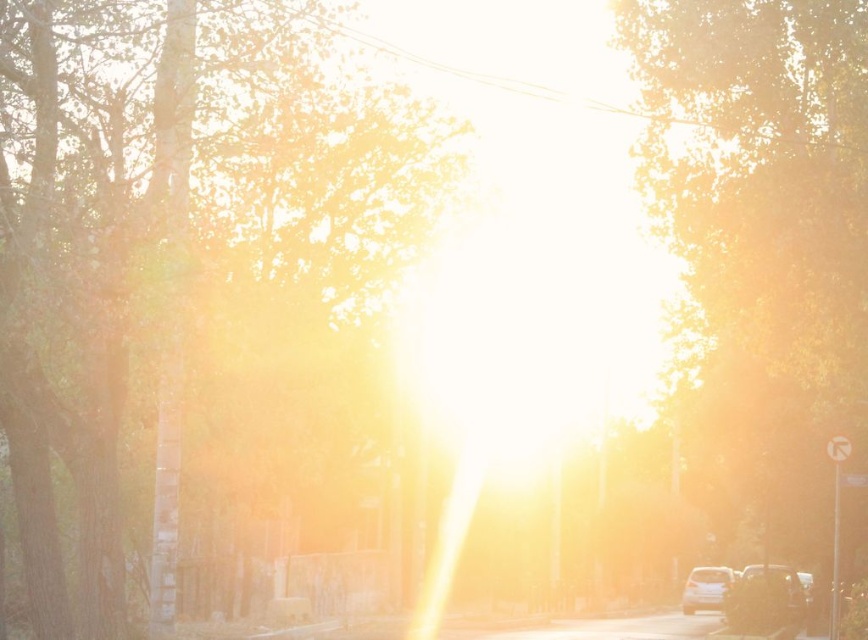
Question: Does smooth golden tree at right come behind satin white car at lower right?

Choices:
 (A) yes
 (B) no

Answer: (B)

Question: Which object appears farthest from the camera in this image?

Choices:
 (A) smokey black car at lower right
 (B) white plastic street sign at center
 (C) smooth brown tree trunk at center
 (D) satin white car at lower right

Answer: (D)

Question: Can you confirm if smooth brown tree trunk at center is positioned below white plastic street sign at center?

Choices:
 (A) yes
 (B) no

Answer: (B)

Question: Among these objects, which one is nearest to the camera?

Choices:
 (A) smooth golden tree at right
 (B) smokey black car at lower right

Answer: (A)

Question: Does smooth golden tree at right have a lesser width compared to smokey black car at lower right?

Choices:
 (A) no
 (B) yes

Answer: (A)

Question: Which point appears farthest from the camera in this image?

Choices:
 (A) (686, 604)
 (B) (834, 435)

Answer: (A)